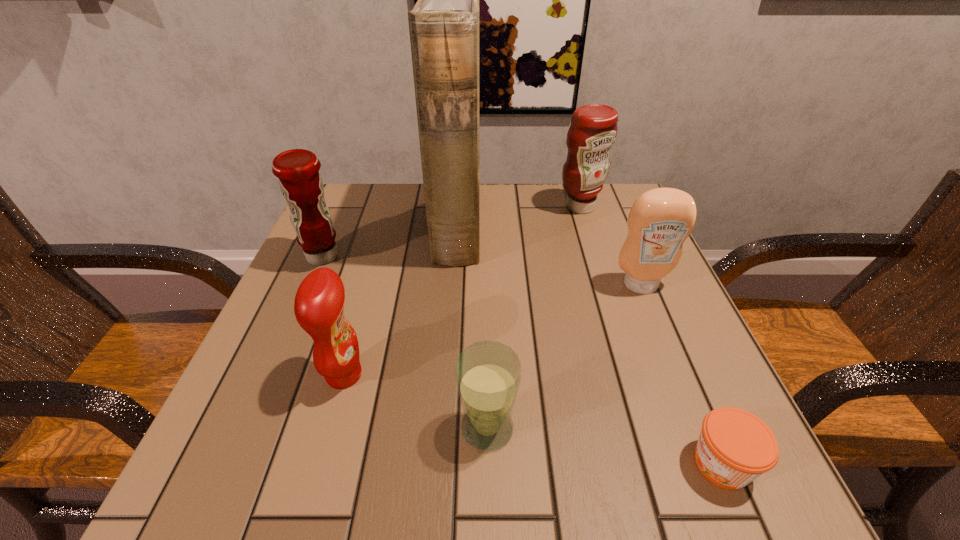
Locate an element on the screen. vacant region at the near left corner of the desktop is located at coordinates (193, 500).

Image resolution: width=960 pixels, height=540 pixels. In order to click on free space at the far right corner in this screenshot , I will do `click(604, 193)`.

In the image, there is a desktop. In order to click on free space at the near right corner in this screenshot , I will do `click(657, 450)`.

Locate an element on the screen. Image resolution: width=960 pixels, height=540 pixels. free space between the second shortest object and the third nearest condiment is located at coordinates (405, 342).

Where is `empty location between the farthest condiment and the shortest object`? The height and width of the screenshot is (540, 960). empty location between the farthest condiment and the shortest object is located at coordinates (651, 335).

You are a GUI agent. You are given a task and a screenshot of the screen. Output one action in this format:
    pyautogui.click(x=<x>, y=<y>)
    Task: Click on the vacant area that lies between the leftmost object and the fourth nearest object
    This screenshot has width=960, height=540.
    Given the screenshot: What is the action you would take?
    pyautogui.click(x=482, y=271)

Find the location of a particular element. The image size is (960, 540). vacant area between the phonebook and the farthest condiment is located at coordinates (518, 217).

The height and width of the screenshot is (540, 960). I want to click on free space between the farthest condiment and the glass, so click(534, 318).

I want to click on free space between the nearest condiment and the sixth tallest object, so click(x=416, y=402).

Locate an element on the screen. empty space between the second nearest condiment and the phonebook is located at coordinates point(549,256).